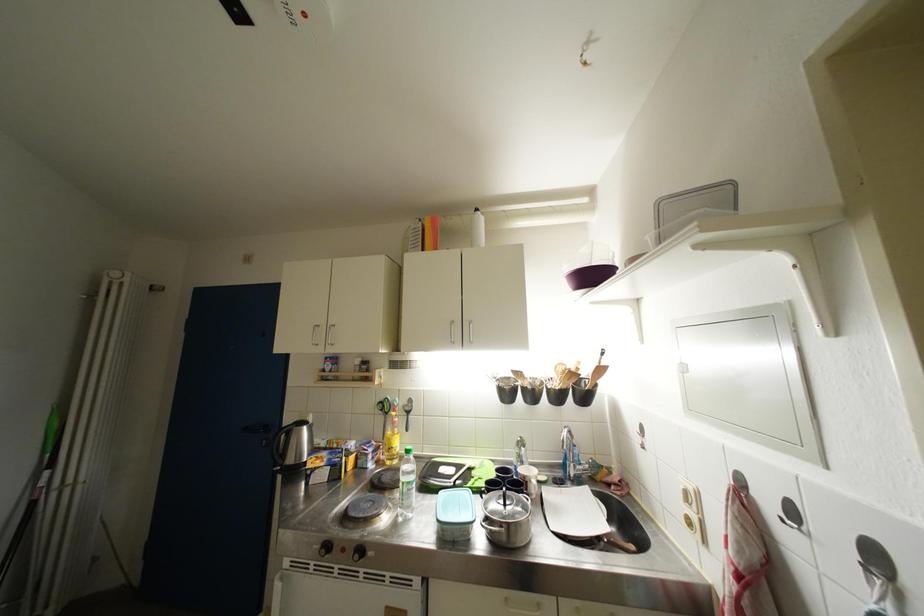
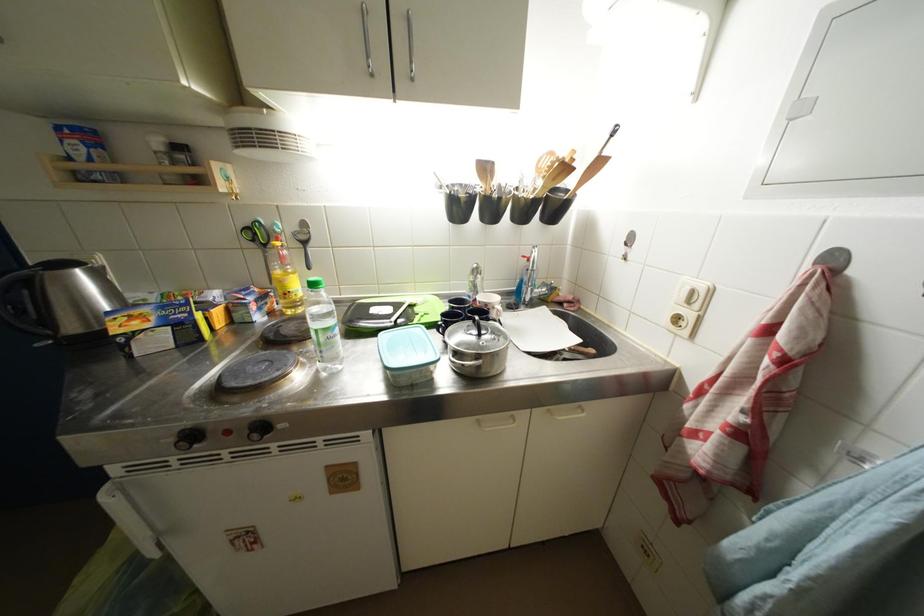
In the second image, find the point that corresponds to (695,506) in the first image.

(696, 306)